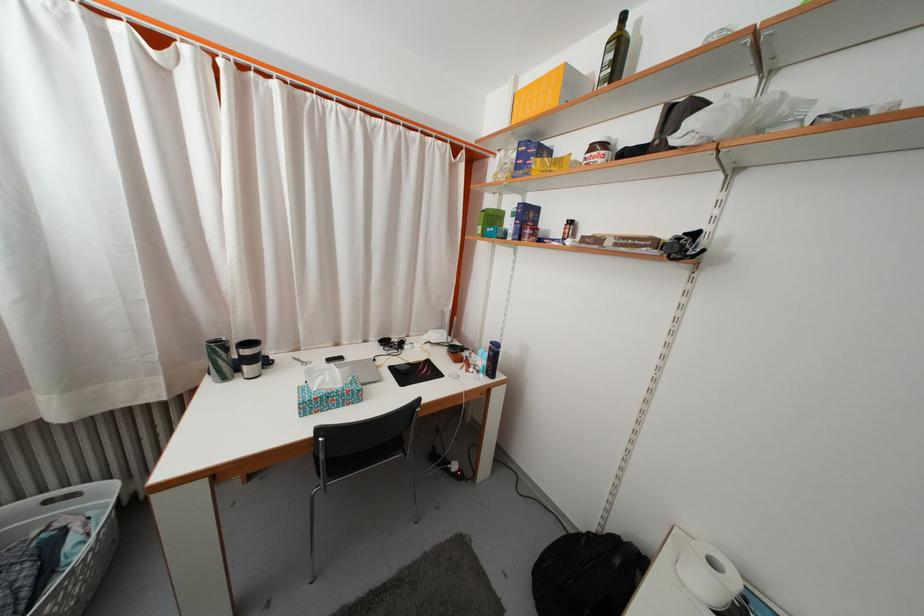
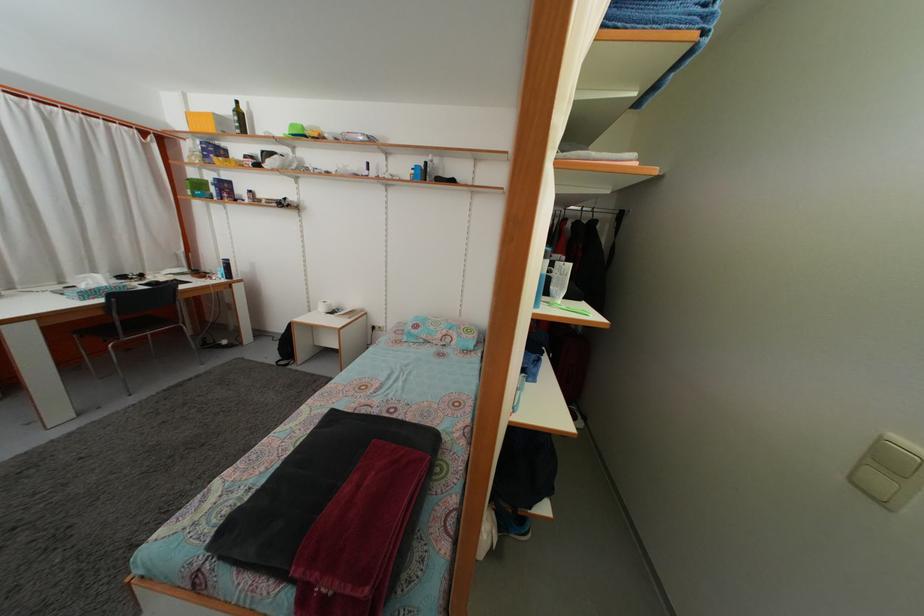
The point at (625, 54) is marked in the first image. Where is the corresponding point in the second image?

(246, 122)